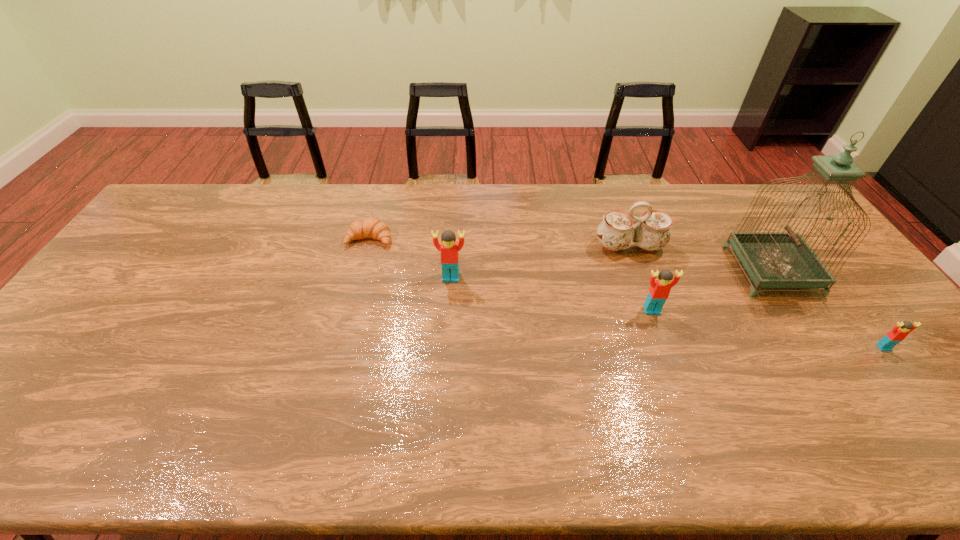
Where is `the leftmost Lego`? the leftmost Lego is located at coordinates (449, 249).

This screenshot has height=540, width=960. Identify the location of the fifth object from right to left. (449, 249).

At what (x,y) coordinates should I click in order to perform the action: click on the second tallest Lego. Please return your answer as a coordinate pair (x, y). The width and height of the screenshot is (960, 540). Looking at the image, I should click on (660, 288).

Where is `the second nearest Lego`? the second nearest Lego is located at coordinates (660, 288).

Locate an element on the screen. This screenshot has height=540, width=960. the fifth tallest object is located at coordinates (901, 330).

Where is `the nearest object`? The image size is (960, 540). the nearest object is located at coordinates (901, 330).

Find the location of a particular element. Image resolution: width=960 pixels, height=540 pixels. the tallest object is located at coordinates (773, 259).

I want to click on the fifth object from left to right, so 773,259.

This screenshot has height=540, width=960. I want to click on the leftmost object, so click(x=371, y=227).

The width and height of the screenshot is (960, 540). What are the coordinates of `the shortest object` in the screenshot? It's located at (371, 227).